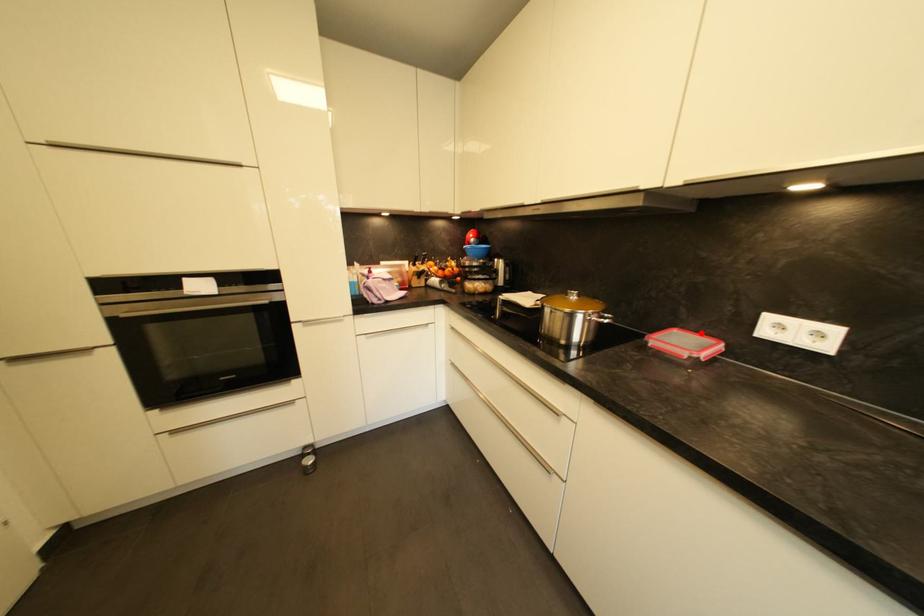
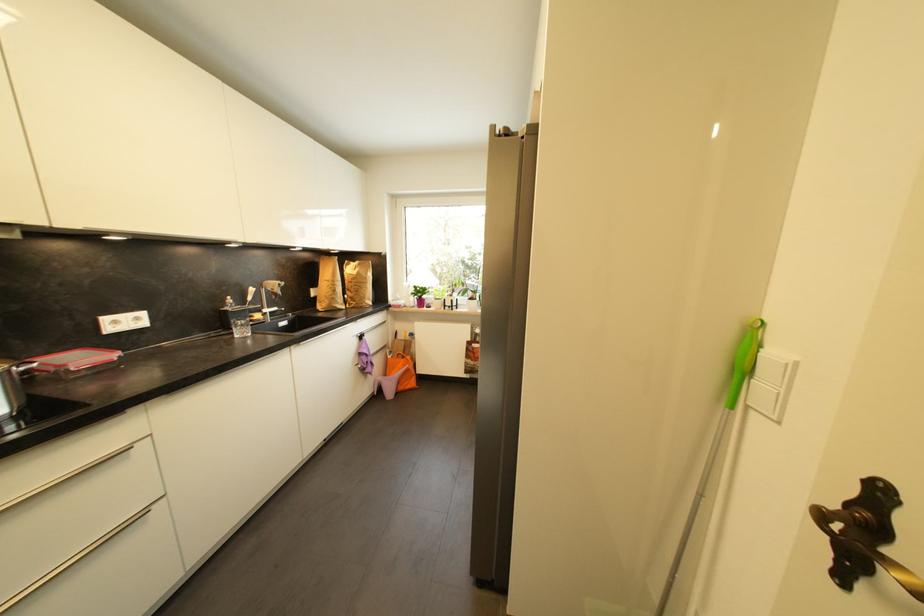
Question: I am providing you with two images of the same scene from different viewpoints. A red point is shown in image1. For the corresponding object point in image2, is it positioned nearer or farther from the camera?

Choices:
 (A) Nearer
 (B) Farther

Answer: (B)